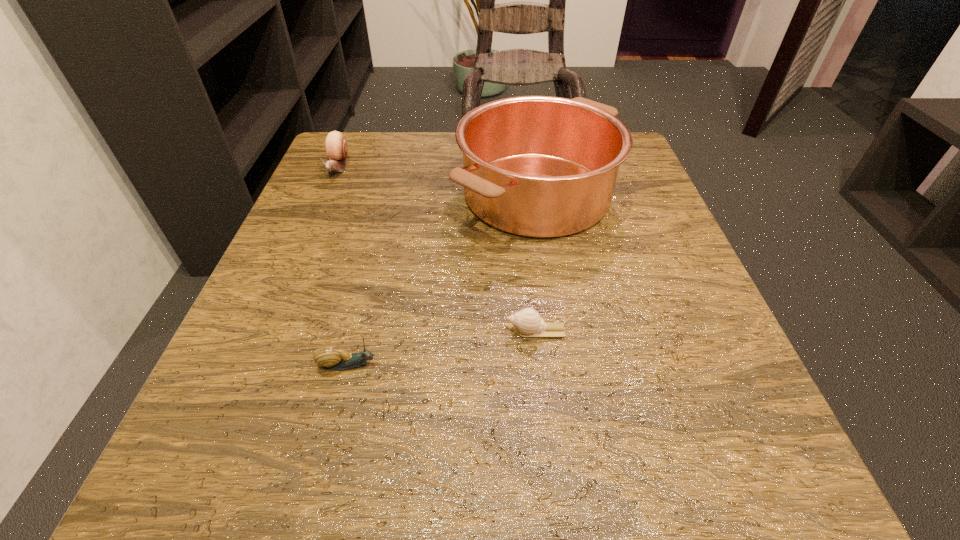
Where is `vacant space that's between the nearest object and the tallest object`? This screenshot has height=540, width=960. vacant space that's between the nearest object and the tallest object is located at coordinates (443, 279).

Identify the location of vacant area that lies between the third farthest object and the third object from right to left. (444, 348).

Where is `object that is the closest to the third farthest object`? The width and height of the screenshot is (960, 540). object that is the closest to the third farthest object is located at coordinates (537, 166).

Find the location of a particular element. The width and height of the screenshot is (960, 540). object that is the closest to the saucepan is located at coordinates (527, 322).

Identify which escargot is located as the nearest to the farthest escargot. Please provide its 2D coordinates. Your answer should be formatted as a tuple, i.e. [(x, y)], where the tuple contains the x and y coordinates of a point satisfying the conditions above.

[(329, 356)]

The height and width of the screenshot is (540, 960). I want to click on escargot that is the closest one to the second nearest object, so click(329, 356).

At what (x,y) coordinates should I click in order to perform the action: click on free point that satisfies the following two spatial constraints: 1. on the front-facing side of the saucepan; 2. on the right side of the leftmost object. Please return your answer as a coordinate pair (x, y). The image size is (960, 540). Looking at the image, I should click on (326, 194).

The width and height of the screenshot is (960, 540). I want to click on free point that satisfies the following two spatial constraints: 1. on the front side of the saucepan; 2. on the shell of the rightmost escargot, so click(x=558, y=331).